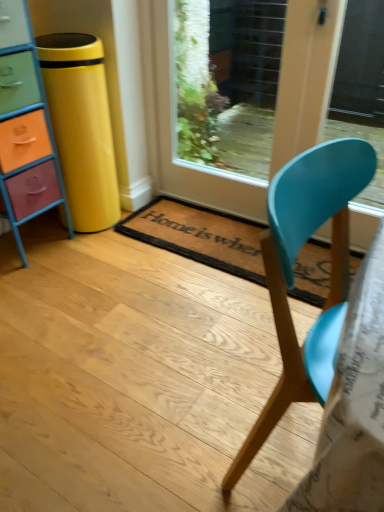
Locate an element on the screen. The width and height of the screenshot is (384, 512). vacant space situated above brown coir mat at center (from a real-world perspective) is located at coordinates (204, 234).